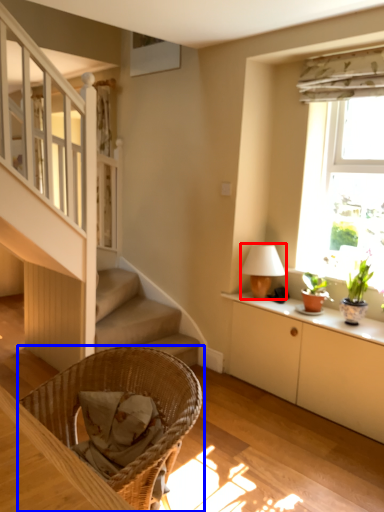
Question: Which object is further to the camera taking this photo, table lamp (highlighted by a red box) or chair (highlighted by a blue box)?

Choices:
 (A) table lamp
 (B) chair

Answer: (A)